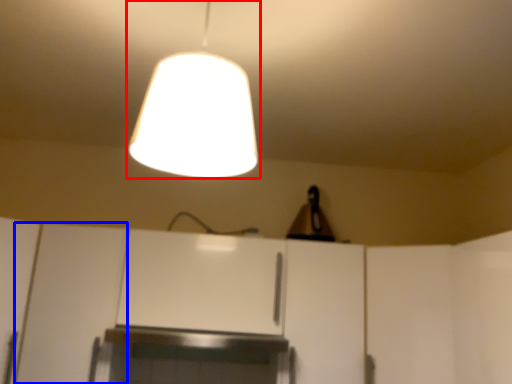
Question: Among these objects, which one is nearest to the camera, lamp (highlighted by a red box) or cabinetry (highlighted by a blue box)?

Choices:
 (A) lamp
 (B) cabinetry

Answer: (A)